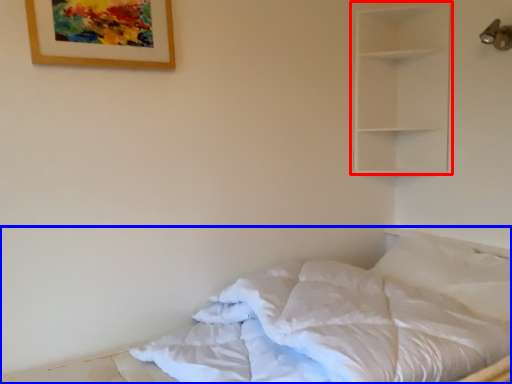
Question: Which of the following is the closest to the observer, shelf (highlighted by a red box) or bed (highlighted by a blue box)?

Choices:
 (A) shelf
 (B) bed

Answer: (B)